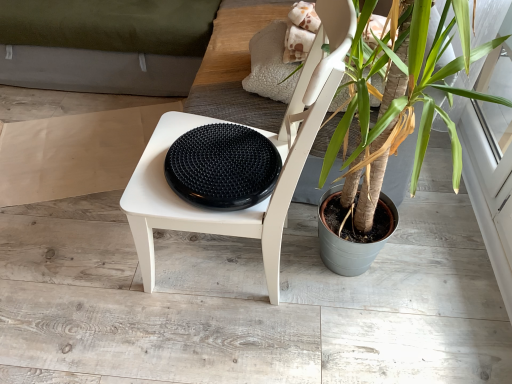
This screenshot has height=384, width=512. Find the location of `free spot below green leafy plant at center (from a real-world perspective)`. free spot below green leafy plant at center (from a real-world perspective) is located at coordinates (375, 272).